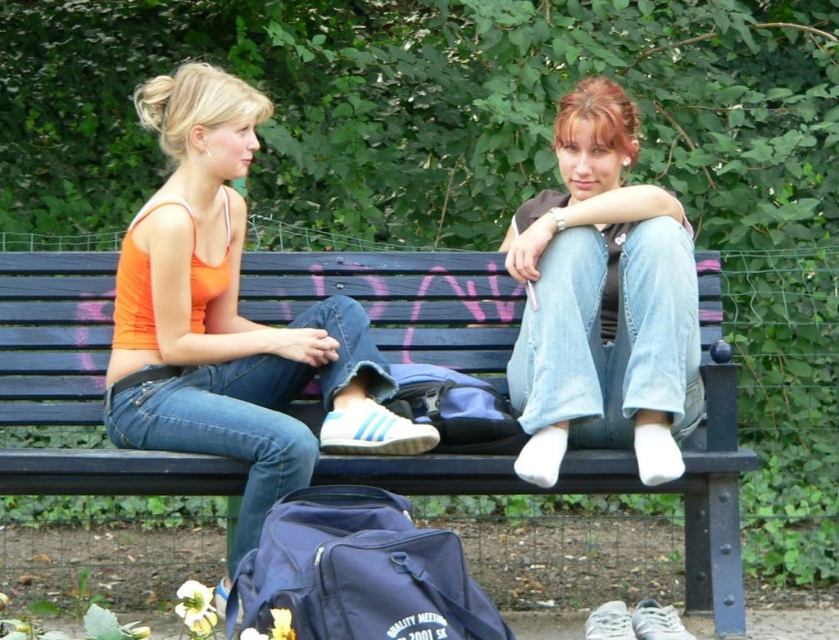
Between black wood bench at center and orange fabric tank top at left, which one has more height?

Standing taller between the two is orange fabric tank top at left.

Can you confirm if black wood bench at center is wider than orange fabric tank top at left?

Indeed, black wood bench at center has a greater width compared to orange fabric tank top at left.

Image resolution: width=839 pixels, height=640 pixels. I want to click on black wood bench at center, so click(x=624, y=474).

Where is `black wood bench at center`? The width and height of the screenshot is (839, 640). black wood bench at center is located at coordinates (624, 474).

Is black wood bench at center above denim jeans at center?

No.

Based on the photo, who is more distant from viewer, (x=712, y=557) or (x=691, y=324)?

The point (x=712, y=557) is more distant.

Does point (388, 326) come in front of point (540, 200)?

No, (388, 326) is behind (540, 200).

I want to click on black wood bench at center, so point(624,474).

Does orange fabric tank top at left come behind denim jeans at center?

No.

Who is more distant from viewer, (128,344) or (572,96)?

Point (572,96)

Find the location of `orange fabric tank top at left`. orange fabric tank top at left is located at coordinates (230, 321).

Locate an element on the screen. This screenshot has width=839, height=640. orange fabric tank top at left is located at coordinates (230, 321).